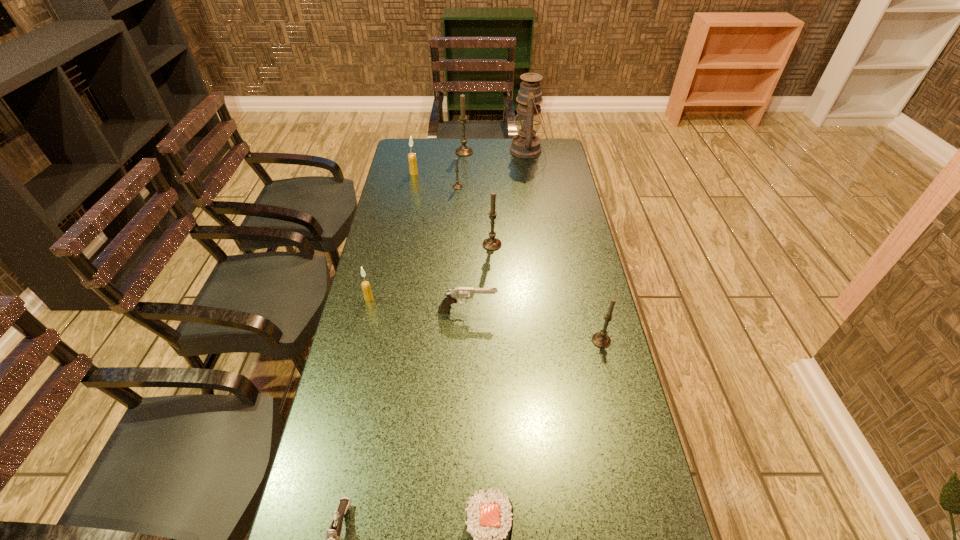
Identify the location of unoccupied area between the left cream candle and the right gun. This screenshot has width=960, height=540. (419, 305).

Point out which object is positioned as the sixth nearest to the farthest gray candle. Please provide its 2D coordinates. Your answer should be formatted as a tuple, i.e. [(x, y)], where the tuple contains the x and y coordinates of a point satisfying the conditions above.

[(452, 296)]

Locate an element on the screen. This screenshot has height=540, width=960. object that ranks as the closest to the right gun is located at coordinates (365, 285).

Image resolution: width=960 pixels, height=540 pixels. Find the location of `candle that is the closest to the shorter gun`. candle that is the closest to the shorter gun is located at coordinates click(x=365, y=285).

You are a GUI agent. You are given a task and a screenshot of the screen. Output one action in this format:
    pyautogui.click(x=<x>, y=<y>)
    Task: Click on the candle that is the fourth closest to the farthest candle
    The width and height of the screenshot is (960, 540).
    Given the screenshot: What is the action you would take?
    pyautogui.click(x=365, y=285)

Locate which gray candle is the third closest to the nearer gun. Please provide its 2D coordinates. Your answer should be formatted as a tuple, i.e. [(x, y)], where the tuple contains the x and y coordinates of a point satisfying the conditions above.

[(456, 186)]

Where is `gray candle that can be found as the second closest to the fifth farthest candle`? The height and width of the screenshot is (540, 960). gray candle that can be found as the second closest to the fifth farthest candle is located at coordinates (456, 186).

The width and height of the screenshot is (960, 540). Identify the location of free space in the image that satisfies the following two spatial constraints: 1. at the muzzle of the right gun; 2. on the left side of the second smallest gray candle. (467, 340).